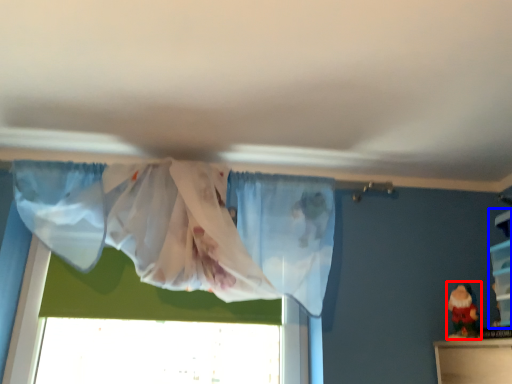
Question: Which object appears farthest to the camera in this image, toy (highlighted by a red box) or shelf (highlighted by a blue box)?

Choices:
 (A) toy
 (B) shelf

Answer: (A)